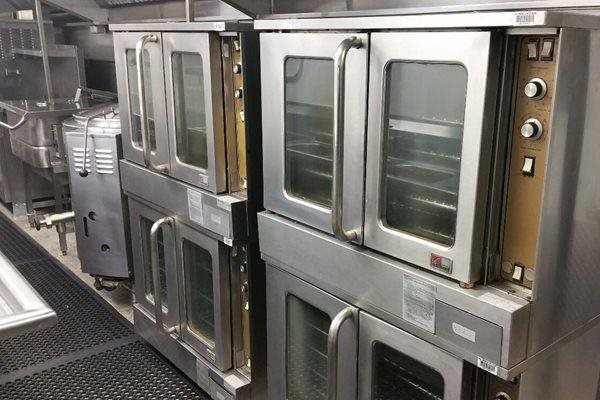
Locate an element on the screen. This screenshot has height=400, width=600. white switches is located at coordinates (527, 169), (517, 274).